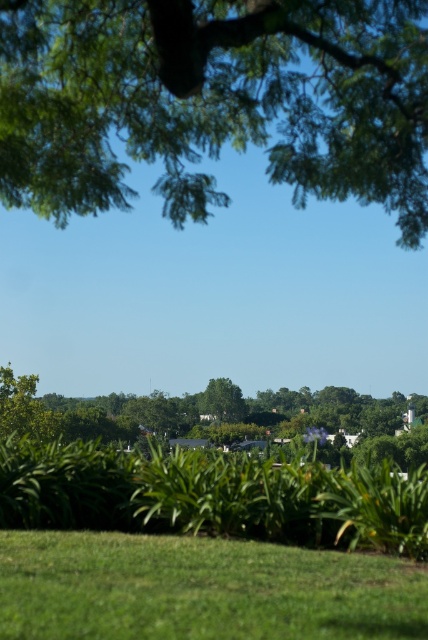
Between green leafy tree at upper center and green leafy tree at center, which one has less height?

With less height is green leafy tree at upper center.

Between green leafy tree at upper center and green leafy tree at center, which one appears on the left side from the viewer's perspective?

From the viewer's perspective, green leafy tree at upper center appears more on the left side.

Measure the distance between green leafy tree at upper center and camera.

A distance of 12.87 meters exists between green leafy tree at upper center and camera.

You are a GUI agent. You are given a task and a screenshot of the screen. Output one action in this format:
    pyautogui.click(x=<x>, y=<y>)
    Task: Click on the green leafy tree at upper center
    
    Given the screenshot: What is the action you would take?
    pyautogui.click(x=213, y=100)

Can you confirm if green grassy field at lower center is thinner than green leafy tree at center?

Correct, green grassy field at lower center's width is less than green leafy tree at center's.

Between point (193, 576) and point (341, 451), which one is positioned behind?

The point (341, 451) is behind.

Find the location of a particular element. green grassy field at lower center is located at coordinates (201, 589).

Identify the location of green grassy field at lower center. (201, 589).

Between green leafy tree at upper center and green grassy field at lower center, which one appears on the right side from the viewer's perspective?

Positioned to the right is green grassy field at lower center.

Does point (107, 170) come in front of point (100, 627)?

No, (107, 170) is further to viewer.

Where is `green leafy tree at upper center`? green leafy tree at upper center is located at coordinates (213, 100).